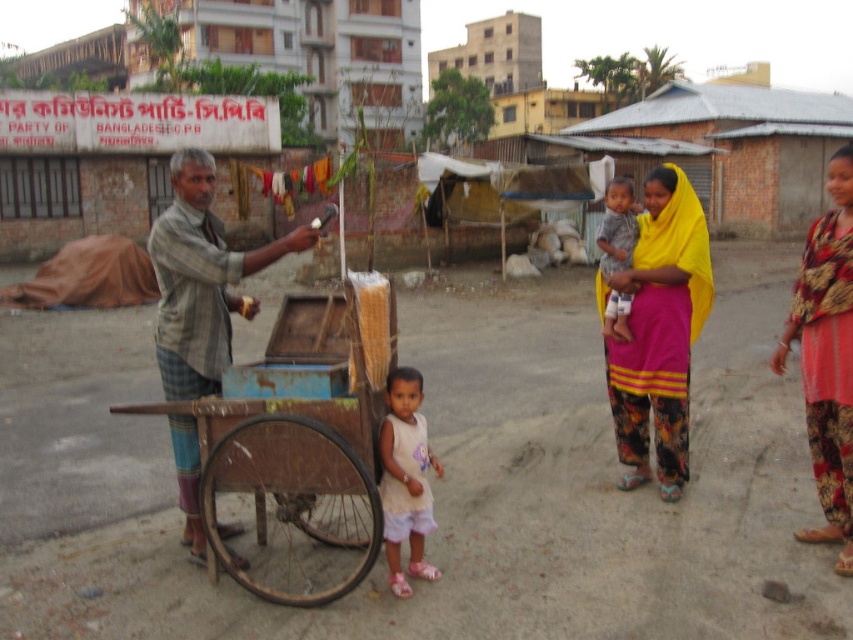
Question: Observing the image, what is the correct spatial positioning of rusty wood cart at center in reference to yellow fabric at center?

Choices:
 (A) right
 (B) left

Answer: (B)

Question: Where is yellow fabric at center located in relation to floral fabric dress at right in the image?

Choices:
 (A) right
 (B) left

Answer: (B)

Question: In this image, where is striped fabric man at center located relative to yellow fabric baby at center?

Choices:
 (A) left
 (B) right

Answer: (A)

Question: Which point is closer to the camera?

Choices:
 (A) rusty wood cart at center
 (B) yellow fabric at center
 (C) striped fabric man at center
 (D) floral fabric dress at right

Answer: (A)

Question: Which object is positioned farthest from the yellow fabric baby at center?

Choices:
 (A) floral fabric dress at right
 (B) white cotton dress at center

Answer: (A)

Question: Considering the real-world distances, which object is closest to the yellow fabric at center?

Choices:
 (A) rusty wood cart at center
 (B) white cotton dress at center
 (C) floral fabric dress at right

Answer: (B)